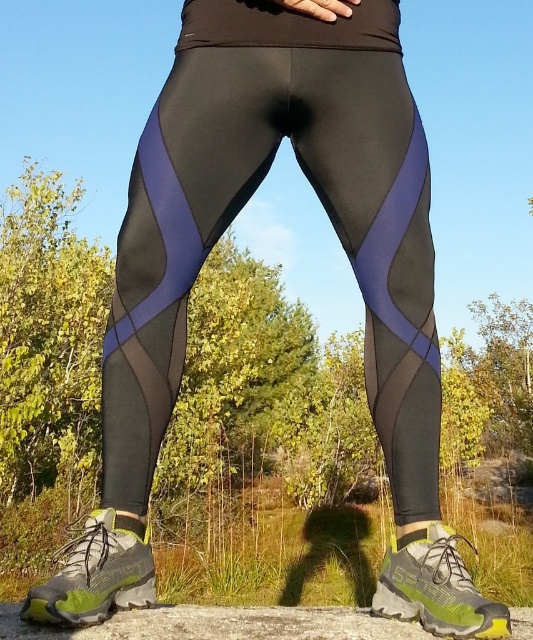
You are a fashion designer analyzing the image. You need to determine if the black mesh leggings at center are covering any part of the green mesh running shoe at lower right. Based on the image, what do you observe?

The black mesh leggings at center is positioned over green mesh running shoe at lower right, indicating that the leggings are covering part of the shoe.

You are a photographer setting up a shoot in a green forest. You want to capture both green mesh running shoe at lower left and green mesh running shoe at lower right clearly. Which shoe should you focus on to ensure the one closer to the camera is sharp?

The green mesh running shoe at lower left is in front of the green mesh running shoe at lower right, so you should focus on the green mesh running shoe at lower left to ensure the closer one is sharp.

Consider the image. You are a photographer setting up a shoot focusing on the lower body. You want to ensure that both the black mesh leggings at center and the green mesh running shoe at lower left are clearly visible in the frame. Based on their positions, which object might partially obscure the other?

The green mesh running shoe at lower left is behind the black mesh leggings at center, so the black mesh leggings at center may partially obscure the green mesh running shoe at lower left.